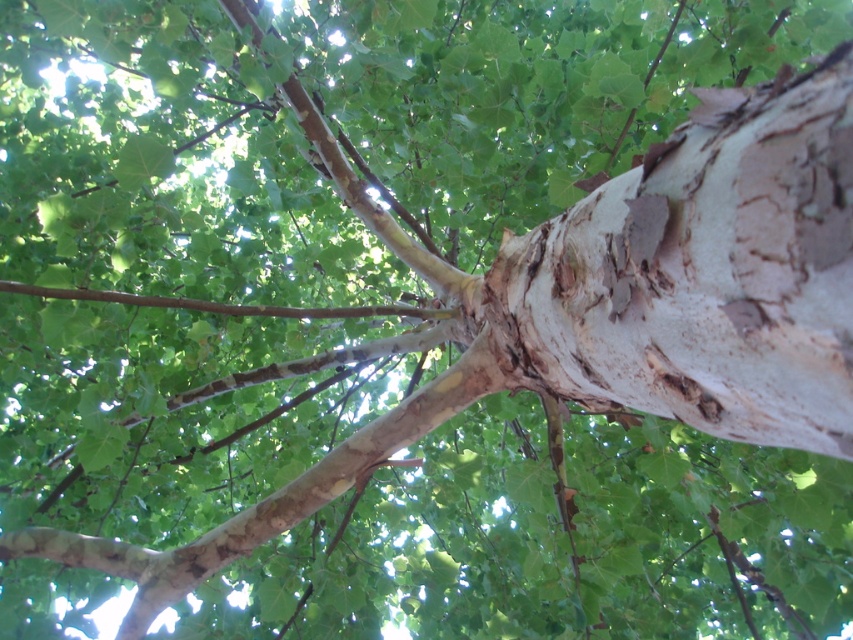
Question: Which object appears closest to the camera in this image?

Choices:
 (A) brown rough branch at center
 (B) white rough bark at center

Answer: (B)

Question: Does white rough bark at center have a larger size compared to brown rough branch at center?

Choices:
 (A) yes
 (B) no

Answer: (A)

Question: Is white rough bark at center positioned at the back of brown rough branch at center?

Choices:
 (A) yes
 (B) no

Answer: (B)

Question: Can you confirm if white rough bark at center is smaller than brown rough branch at center?

Choices:
 (A) no
 (B) yes

Answer: (A)

Question: Among these points, which one is farthest from the camera?

Choices:
 (A) (654, 205)
 (B) (456, 310)

Answer: (B)